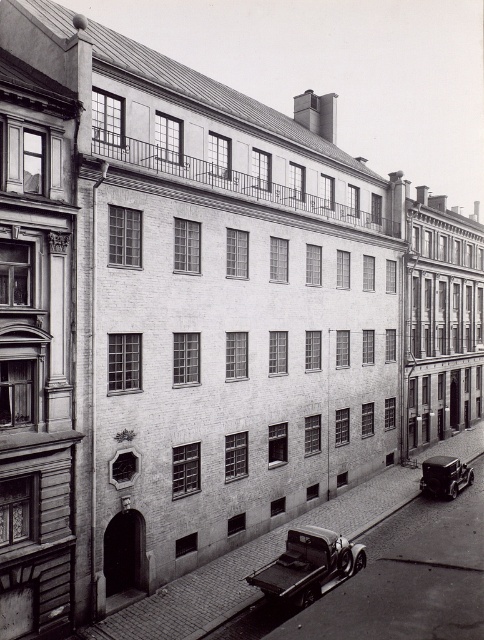
Question: Among these objects, which one is farthest from the camera?

Choices:
 (A) shiny black car at lower right
 (B) metallic silver truck at center

Answer: (A)

Question: Can you confirm if metallic silver truck at center is positioned to the left of shiny black car at lower right?

Choices:
 (A) no
 (B) yes

Answer: (B)

Question: Is metallic silver truck at center wider than shiny black car at lower right?

Choices:
 (A) no
 (B) yes

Answer: (B)

Question: Can you confirm if metallic silver truck at center is positioned to the left of shiny black car at lower right?

Choices:
 (A) no
 (B) yes

Answer: (B)